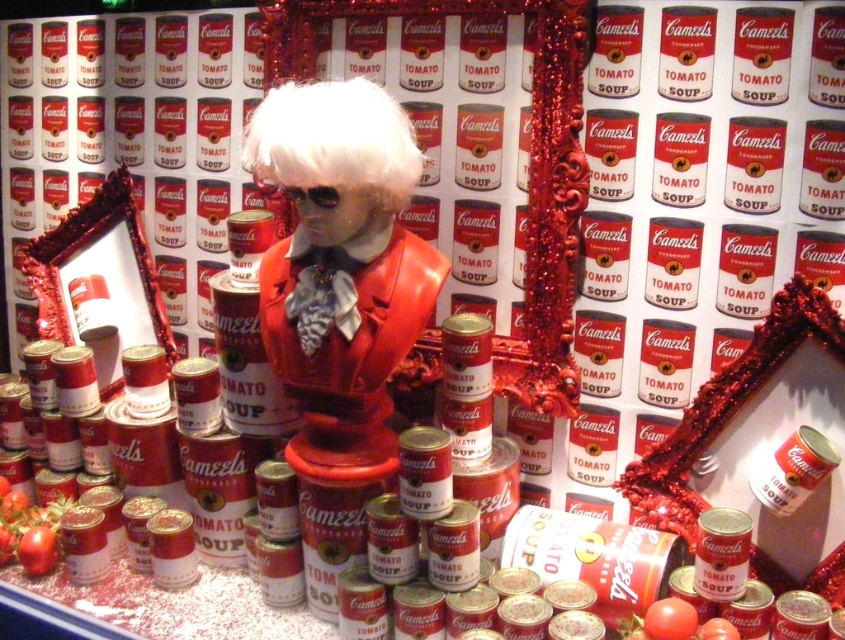
You are an art curator planning to move the shiny plastic bust at center to a new location in the gallery. The current coordinates of the bust are at point 0.416, 0.405. If you want to place it exactly 0.1 units to the right and 0.05 units higher than its current position, what will be the new coordinates?

The new coordinates would be (384,330).

You are an art curator examining the installation. You notice the shiny plastic bust at center and the white matte wig at center. Based on their positions, which object is closer to the viewer?

The shiny plastic bust at center is below the white matte wig at center, so the white matte wig at center is closer to the viewer.

You are an art curator examining the installation. You notice the shiny plastic bust at center and the white matte wig at center. Which object is closer to the viewer?

The shiny plastic bust at center is closer to the viewer than the white matte wig at center, as the wig is positioned behind the bust.